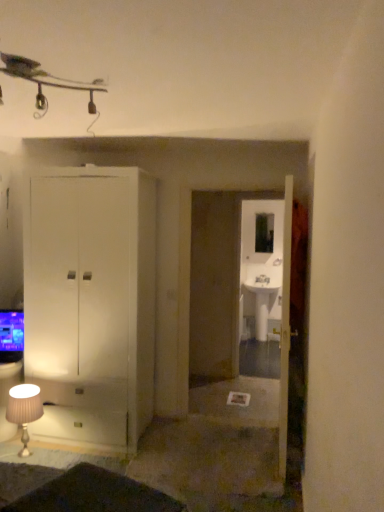
This screenshot has height=512, width=384. Find the location of `white glossy door at center`. white glossy door at center is located at coordinates 285,328.

In order to face white glossy sink at center, should I rotate leftwards or rightwards?

You should rotate right by 9.477 degrees.

Image resolution: width=384 pixels, height=512 pixels. What do you see at coordinates (261, 287) in the screenshot?
I see `transparent glass sink at center` at bounding box center [261, 287].

Locate an element on the screen. The image size is (384, 512). transparent glass sink at center is located at coordinates (261, 287).

Locate an element on the screen. The height and width of the screenshot is (512, 384). blue glossy television at lower left is located at coordinates (11, 336).

From the image's perspective, does white glossy door at center appear lower than white glossy sink at center?

No.

In terms of height, does white glossy door at center look taller or shorter compared to white glossy sink at center?

Considering their sizes, white glossy door at center has more height than white glossy sink at center.

How far apart are white glossy door at center and white glossy sink at center?

white glossy door at center and white glossy sink at center are 2.52 meters apart.

Is white glossy door at center positioned with its back to white glossy sink at center?

No.

From their relative heights in the image, would you say blue glossy television at lower left is taller or shorter than white glossy door at center?

blue glossy television at lower left is shorter than white glossy door at center.

Does point (10, 327) come in front of point (287, 406)?

No, it is behind (287, 406).

From the image's perspective, is blue glossy television at lower left located above or below white glossy door at center?

Clearly, from the image's perspective, blue glossy television at lower left is below white glossy door at center.

From a real-world perspective, between blue glossy television at lower left and white glossy door at center, who is vertically higher?

white glossy door at center.

From a real-world perspective, who is located higher, white glossy door at center or blue glossy television at lower left?

In real-world perspective, white glossy door at center is above.

Is white glossy door at center completely or partially outside of blue glossy television at lower left?

Yes, white glossy door at center is not within blue glossy television at lower left.

Is white glossy door at center positioned with its back to blue glossy television at lower left?

No, white glossy door at center's orientation is not away from blue glossy television at lower left.

Considering the relative sizes of white glossy door at center and blue glossy television at lower left in the image provided, is white glossy door at center shorter than blue glossy television at lower left?

No, white glossy door at center is not shorter than blue glossy television at lower left.

Would you consider white glossy sink at center to be distant from white fabric lampshade at lower left?

Yes, white glossy sink at center is far from white fabric lampshade at lower left.

How far apart are white glossy sink at center and white fabric lampshade at lower left?

white glossy sink at center is 11.61 feet away from white fabric lampshade at lower left.

Is white glossy sink at center turned away from white fabric lampshade at lower left?

No, white glossy sink at center is not facing the opposite direction of white fabric lampshade at lower left.

Is white glossy sink at center closer to the viewer compared to white fabric lampshade at lower left?

No, it is behind white fabric lampshade at lower left.

In terms of height, does white glossy door at center look taller or shorter compared to transparent glass sink at center?

Considering their sizes, white glossy door at center has less height than transparent glass sink at center.

How many degrees apart are the facing directions of white glossy door at center and transparent glass sink at center?

white glossy door at center and transparent glass sink at center are facing 90.7 degrees away from each other.

Considering the sizes of objects white glossy door at center and transparent glass sink at center in the image provided, who is smaller, white glossy door at center or transparent glass sink at center?

Smaller between the two is transparent glass sink at center.

Are white glossy door at center and transparent glass sink at center making contact?

No, white glossy door at center is not with transparent glass sink at center.

From the image's perspective, is clear glass mirror at center above or below white fabric lampshade at lower left?

Based on their image positions, clear glass mirror at center is located above white fabric lampshade at lower left.

Which is more to the left, clear glass mirror at center or white fabric lampshade at lower left?

white fabric lampshade at lower left.

Locate an element on the screen. The image size is (384, 512). mirror behind the white fabric lampshade at lower left is located at coordinates (264, 233).

Is there a large distance between white fabric lampshade at lower left and clear glass mirror at center?

white fabric lampshade at lower left is far away from clear glass mirror at center.

From the image's perspective, is white fabric lampshade at lower left over clear glass mirror at center?

No, from the image's perspective, white fabric lampshade at lower left is not on top of clear glass mirror at center.

Which object is closer to the camera, white fabric lampshade at lower left or clear glass mirror at center?

white fabric lampshade at lower left is more forward.

Locate an element on the screen. This screenshot has height=512, width=384. sink below the white glossy door at center (from a real-world perspective) is located at coordinates (263, 298).

Find the location of a particular element. This screenshot has height=512, width=384. door above the blue glossy television at lower left (from the image's perspective) is located at coordinates (285, 328).

Estimate the real-world distances between objects in this image. Which object is further from white fabric lampshade at lower left, white glossy door at center or white glossy sink at center?

Based on the image, white glossy sink at center appears to be further to white fabric lampshade at lower left.

Considering their positions, is clear glass mirror at center positioned closer to white fabric lampshade at lower left than transparent glass sink at center?

transparent glass sink at center.

Which object lies nearer to the anchor point blue glossy television at lower left, white fabric lampshade at lower left or white glossy door at center?

white fabric lampshade at lower left.

In the scene shown: Considering their positions, is white fabric lampshade at lower left positioned further to transparent glass sink at center than blue glossy television at lower left?

Based on the image, white fabric lampshade at lower left appears to be further to transparent glass sink at center.

Looking at the image, which one is located closer to white glossy door at center, transparent glass sink at center or clear glass mirror at center?

transparent glass sink at center is positioned closer to the anchor white glossy door at center.

Looking at the image, which one is located closer to white glossy sink at center, transparent glass sink at center or white glossy door at center?

transparent glass sink at center lies closer to white glossy sink at center than the other object.

Looking at the image, which one is located closer to white glossy sink at center, white fabric lampshade at lower left or white glossy door at center?

The object closer to white glossy sink at center is white glossy door at center.

Estimate the real-world distances between objects in this image. Which object is closer to white fabric lampshade at lower left, transparent glass sink at center or blue glossy television at lower left?

blue glossy television at lower left is positioned closer to the anchor white fabric lampshade at lower left.

The width and height of the screenshot is (384, 512). What are the coordinates of `lamp situated between blue glossy television at lower left and transparent glass sink at center from left to right` in the screenshot? It's located at (24, 410).

The width and height of the screenshot is (384, 512). In order to click on glass door between white glossy door at center and clear glass mirror at center in the front-back direction in this screenshot , I will do [x=261, y=287].

Find the location of a particular element. television positioned between white fabric lampshade at lower left and clear glass mirror at center from near to far is located at coordinates (11, 336).

This screenshot has height=512, width=384. In order to click on glass door between white glossy door at center and white glossy sink at center from front to back in this screenshot , I will do `click(261, 287)`.